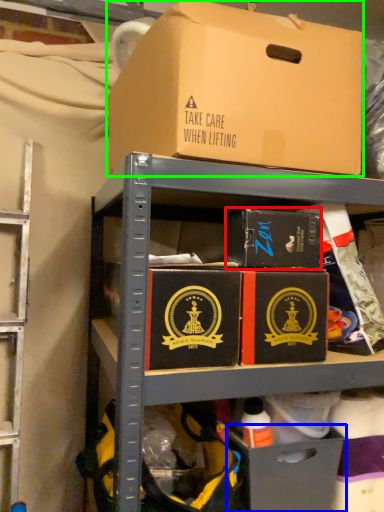
Question: Which object is positioned farthest from box (highlighted by a red box)? Select from drawer (highlighted by a blue box) and box (highlighted by a green box).

Choices:
 (A) drawer
 (B) box

Answer: (A)